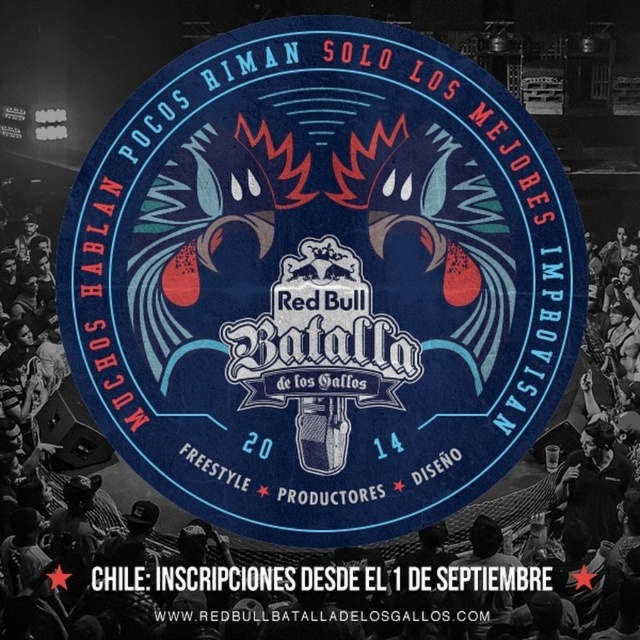
From the picture: Does matte blue circular at center appear under black fabric crowd at center?

Incorrect, matte blue circular at center is not positioned below black fabric crowd at center.

Does matte blue circular at center have a larger size compared to black fabric crowd at center?

No.

Between point (212, 61) and point (596, 348), which one is positioned behind?

The point (596, 348) is more distant.

Find the location of a particular element. matte blue circular at center is located at coordinates (321, 280).